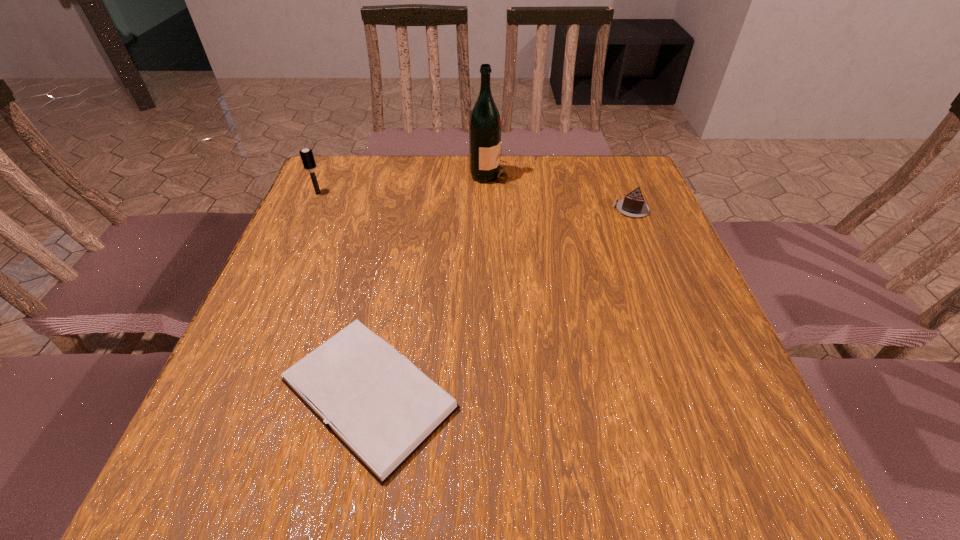
Image resolution: width=960 pixels, height=540 pixels. I want to click on free point located 0.150m on the left of the rightmost object, so click(x=553, y=209).

Where is `blank space located on the back of the second object from left to right`? blank space located on the back of the second object from left to right is located at coordinates (390, 291).

Locate an element on the screen. Image resolution: width=960 pixels, height=540 pixels. wine bottle present at the far edge is located at coordinates (485, 124).

At what (x,y) coordinates should I click in order to perform the action: click on hairbrush located in the far edge section of the desktop. Please return your answer as a coordinate pair (x, y). Looking at the image, I should click on (307, 157).

You are a GUI agent. You are given a task and a screenshot of the screen. Output one action in this format:
    pyautogui.click(x=<x>, y=<y>)
    Task: Click on the chocolate cake at the far edge
    The height and width of the screenshot is (540, 960).
    Given the screenshot: What is the action you would take?
    pyautogui.click(x=632, y=205)

Locate an element on the screen. object at the near edge is located at coordinates (376, 402).

You are a GUI agent. You are given a task and a screenshot of the screen. Output one action in this format:
    pyautogui.click(x=<x>, y=<y>)
    Task: Click on the hairbrush at the left edge
    
    Given the screenshot: What is the action you would take?
    pyautogui.click(x=307, y=157)

Where is `hardback book that is at the left edge`? This screenshot has height=540, width=960. hardback book that is at the left edge is located at coordinates (376, 402).

I want to click on object present at the right edge, so coord(632,205).

Image resolution: width=960 pixels, height=540 pixels. What are the coordinates of `object that is at the far left corner` in the screenshot? It's located at (307, 157).